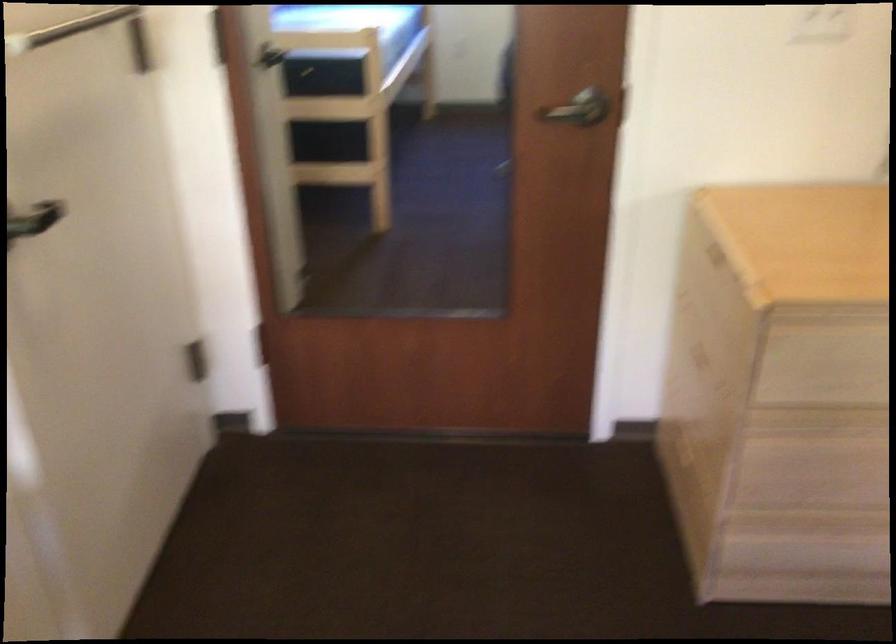
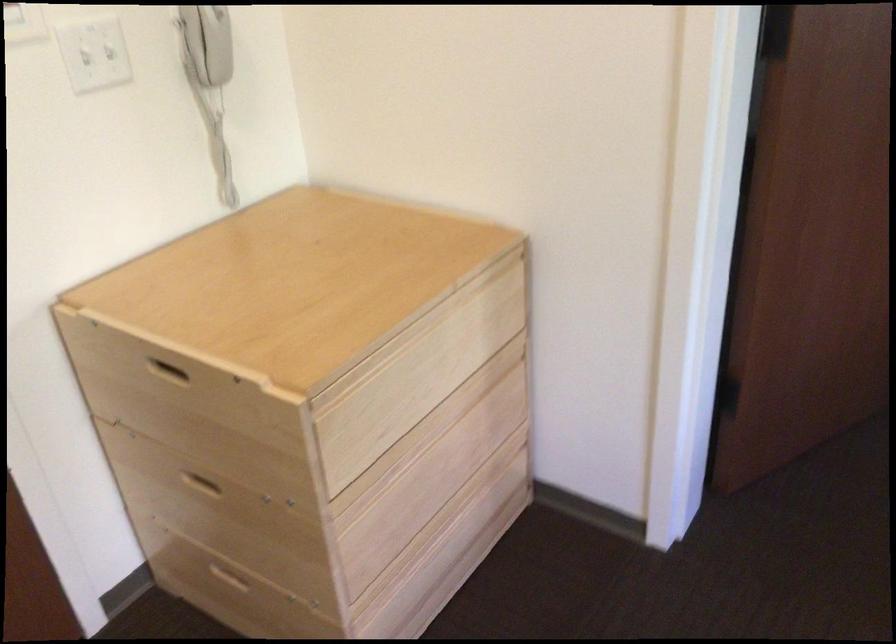
The point at [696,355] is marked in the first image. Where is the corresponding point in the second image?

(201, 483)